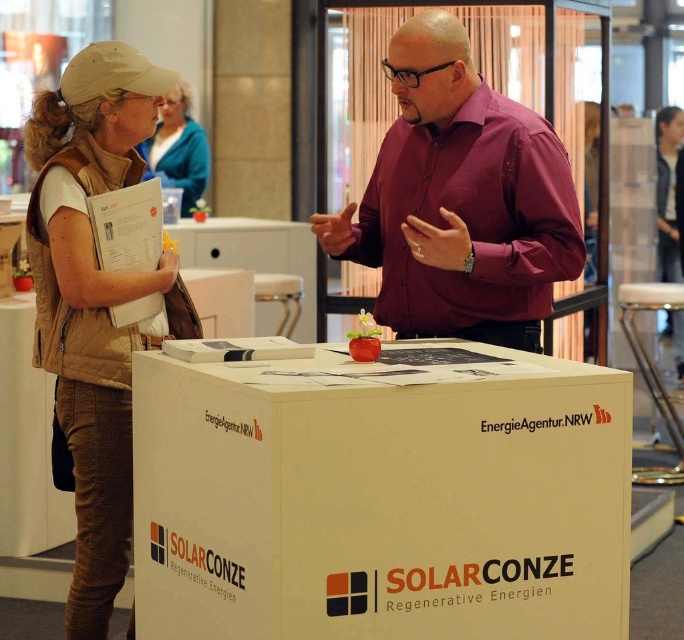
Does burgundy shirt at center have a lesser width compared to blue fabric jacket at upper center?

No, burgundy shirt at center is not thinner than blue fabric jacket at upper center.

Is burgundy shirt at center taller than blue fabric jacket at upper center?

Yes, burgundy shirt at center is taller than blue fabric jacket at upper center.

Is point (486, 266) more distant than point (161, 116)?

No, (486, 266) is in front of (161, 116).

Locate an element on the screen. burgundy shirt at center is located at coordinates click(x=460, y=200).

Can you confirm if white cardboard box at center is taller than burgundy shirt at center?

Incorrect, white cardboard box at center's height is not larger of burgundy shirt at center's.

Based on the photo, is white cardboard box at center shorter than burgundy shirt at center?

Yes.

Where is `white cardboard box at center`? Image resolution: width=684 pixels, height=640 pixels. white cardboard box at center is located at coordinates (381, 497).

Is white cardboard box at center thinner than brown fabric vest at left?

In fact, white cardboard box at center might be wider than brown fabric vest at left.

Between white cardboard box at center and brown fabric vest at left, which one appears on the left side from the viewer's perspective?

From the viewer's perspective, brown fabric vest at left appears more on the left side.

Between point (624, 449) and point (92, 113), which one is positioned in front?

Point (624, 449) is more forward.

Where is `white cardboard box at center`? Image resolution: width=684 pixels, height=640 pixels. white cardboard box at center is located at coordinates (381, 497).